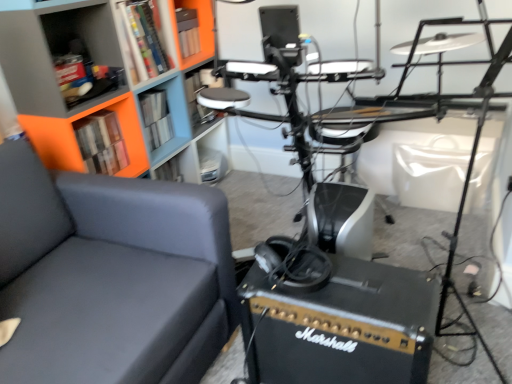
Question: Should I look upward or downward to see hardcover book at upper left, which is counted as the second book, starting from the back?

Choices:
 (A) up
 (B) down

Answer: (A)

Question: Is gray fabric couch at left bigger than orange matte bookcase at upper left?

Choices:
 (A) no
 (B) yes

Answer: (B)

Question: From a real-world perspective, is gray fabric couch at left below orange matte bookcase at upper left?

Choices:
 (A) no
 (B) yes

Answer: (B)

Question: From a real-world perspective, is gray fabric couch at left on orange matte bookcase at upper left?

Choices:
 (A) yes
 (B) no

Answer: (B)

Question: Does gray fabric couch at left have a lesser height compared to orange matte bookcase at upper left?

Choices:
 (A) yes
 (B) no

Answer: (A)

Question: From the image's perspective, does gray fabric couch at left appear higher than orange matte bookcase at upper left?

Choices:
 (A) yes
 (B) no

Answer: (B)

Question: Is gray fabric couch at left at the left side of orange matte bookcase at upper left?

Choices:
 (A) no
 (B) yes

Answer: (B)

Question: From a real-world perspective, is matte plastic shelf at center, placed as the first shelf when sorted from back to front, positioned over hardcover book at upper left, which is counted as the second book, starting from the back, based on gravity?

Choices:
 (A) yes
 (B) no

Answer: (B)

Question: Is the depth of matte plastic shelf at center, the 2th shelf when ordered from left to right, greater than that of hardcover book at upper left, which is counted as the second book, starting from the back?

Choices:
 (A) yes
 (B) no

Answer: (A)

Question: Considering the relative positions of matte plastic shelf at center, the second shelf in the front-to-back sequence, and hardcover book at upper left, arranged as the 1th book when viewed from the front, in the image provided, is matte plastic shelf at center, the second shelf in the front-to-back sequence, to the right of hardcover book at upper left, arranged as the 1th book when viewed from the front, from the viewer's perspective?

Choices:
 (A) yes
 (B) no

Answer: (A)

Question: From the image's perspective, is matte plastic shelf at center, the 2th shelf when ordered from left to right, under hardcover book at upper left, which is counted as the second book, starting from the back?

Choices:
 (A) no
 (B) yes

Answer: (A)

Question: Considering the relative sizes of matte plastic shelf at center, the second shelf in the front-to-back sequence, and hardcover book at upper left, arranged as the 1th book when viewed from the front, in the image provided, is matte plastic shelf at center, the second shelf in the front-to-back sequence, wider than hardcover book at upper left, arranged as the 1th book when viewed from the front,?

Choices:
 (A) no
 (B) yes

Answer: (B)

Question: From a real-world perspective, is matte plastic shelf at center, which is the 1th shelf from right to left, located beneath hardcover book at upper left, which is counted as the second book, starting from the back?

Choices:
 (A) yes
 (B) no

Answer: (A)

Question: Considering the relative sizes of orange matte bookcase at upper left and matte plastic shelf at upper left, the 2th shelf in the back-to-front sequence, in the image provided, is orange matte bookcase at upper left thinner than matte plastic shelf at upper left, the 2th shelf in the back-to-front sequence,?

Choices:
 (A) yes
 (B) no

Answer: (B)